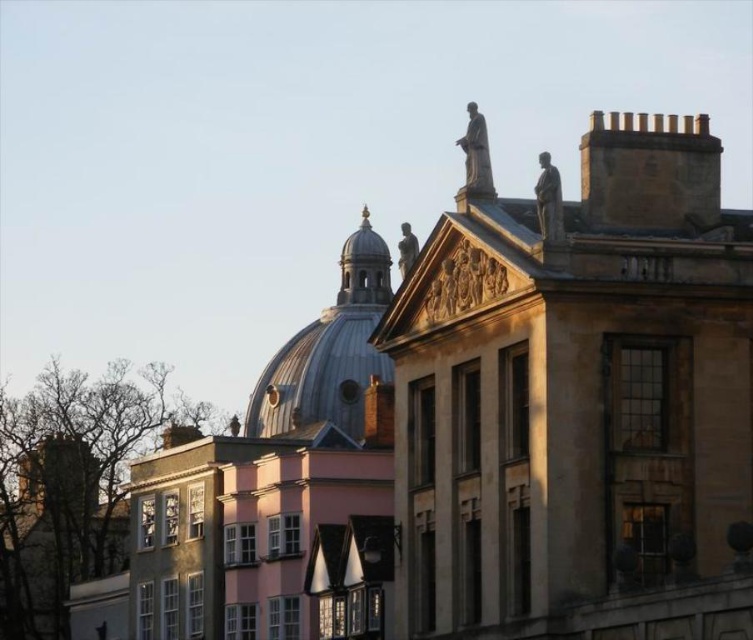
You are standing in the urban scene and want to locate the point at coordinates [578,397]. Based on the scene description, where would this point be located?

The point at coordinates [578,397] is on the beige stone building at upper right.

You are an architect analyzing the urban layout. Based on the scene, which of the two structures, the beige stone building at upper right or the smooth white dome at center, would cast a longer shadow during midday? Explain your reasoning using their positions and sizes.

The beige stone building at upper right is much taller than the smooth white dome at center. Since taller structures generally cast longer shadows, the beige stone building at upper right would cast a longer shadow during midday.